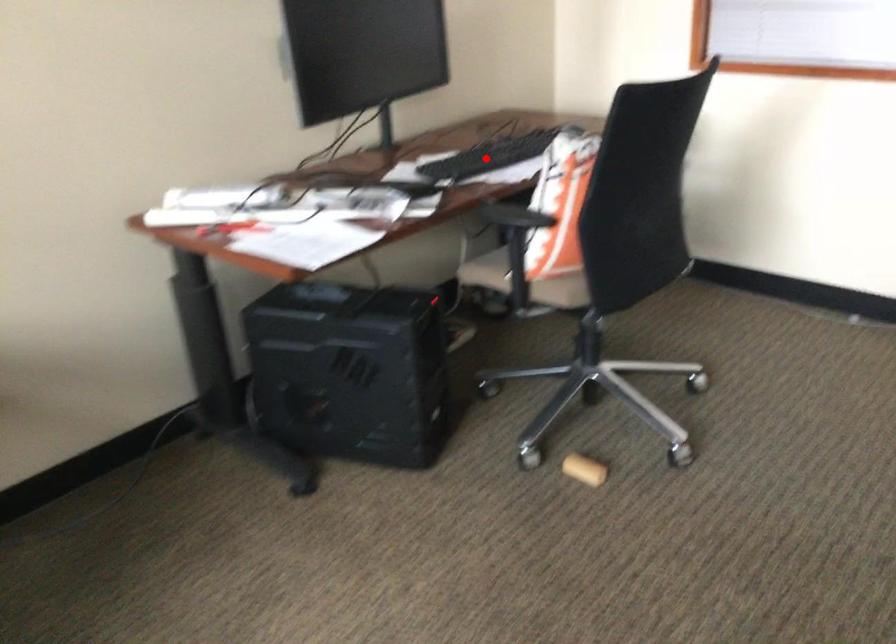
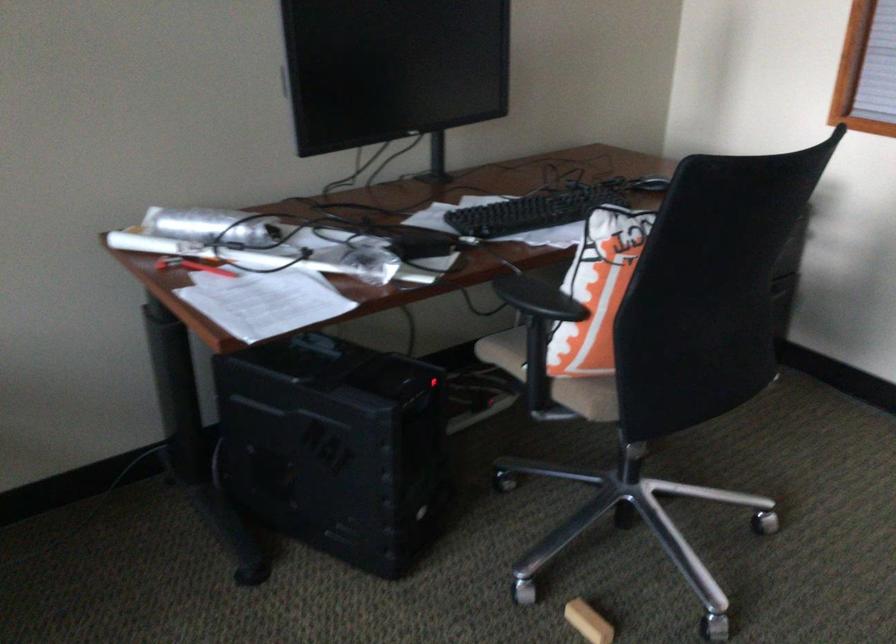
The point at the highlighted location is marked in the first image. Where is the corresponding point in the second image?

(532, 211)